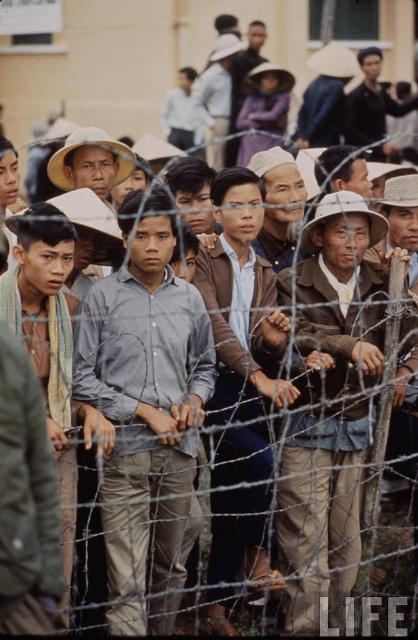
Question: Is light brown fabric shirt at center to the right of dark green jacket at center from the viewer's perspective?

Choices:
 (A) no
 (B) yes

Answer: (B)

Question: Estimate the real-world distances between objects in this image. Which object is closer to the brown leather jacket at center?

Choices:
 (A) light blue shirt at center
 (B) dark blue shirt at upper center
 (C) dark green jacket at center

Answer: (A)

Question: Which point is farther to the camera?

Choices:
 (A) (369, 125)
 (B) (63, 333)
 (C) (222, 275)
 (D) (175, 323)

Answer: (A)

Question: Which of these objects is positioned farthest from the dark green jacket at center?

Choices:
 (A) light blue shirt at center
 (B) brown leather jacket at center
 (C) dark blue shirt at upper center

Answer: (C)

Question: Does light brown fabric shirt at center lie in front of dark green jacket at center?

Choices:
 (A) yes
 (B) no

Answer: (B)

Question: Is light brown fabric shirt at center bigger than dark blue shirt at upper center?

Choices:
 (A) no
 (B) yes

Answer: (B)